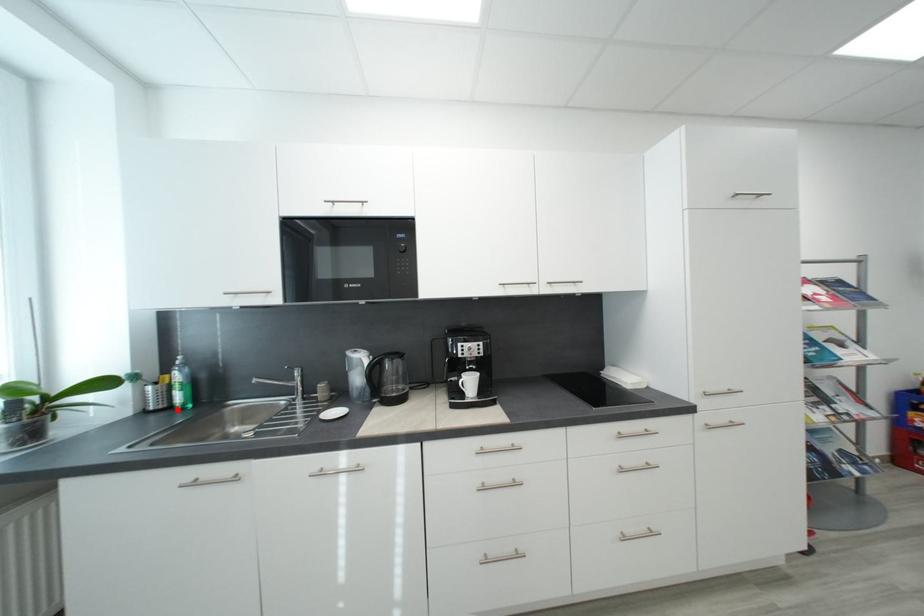
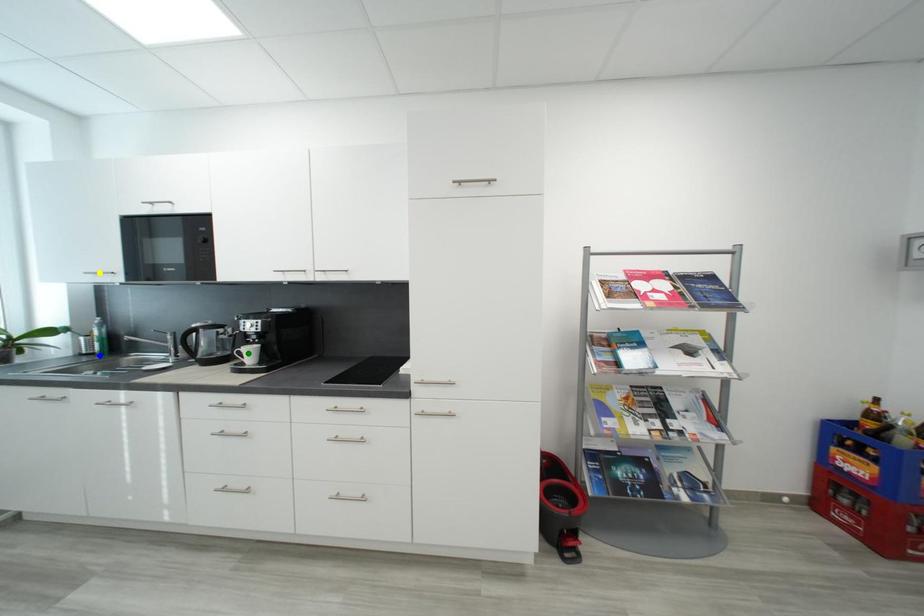
Question: I am providing you with two images of the same scene from different viewpoints. A red point is marked on the first image. You are given multiple points on the second image. Which point in image 2 represents the same 3d spot as the red point in image 1?

Choices:
 (A) yellow point
 (B) blue point
 (C) green point

Answer: (B)